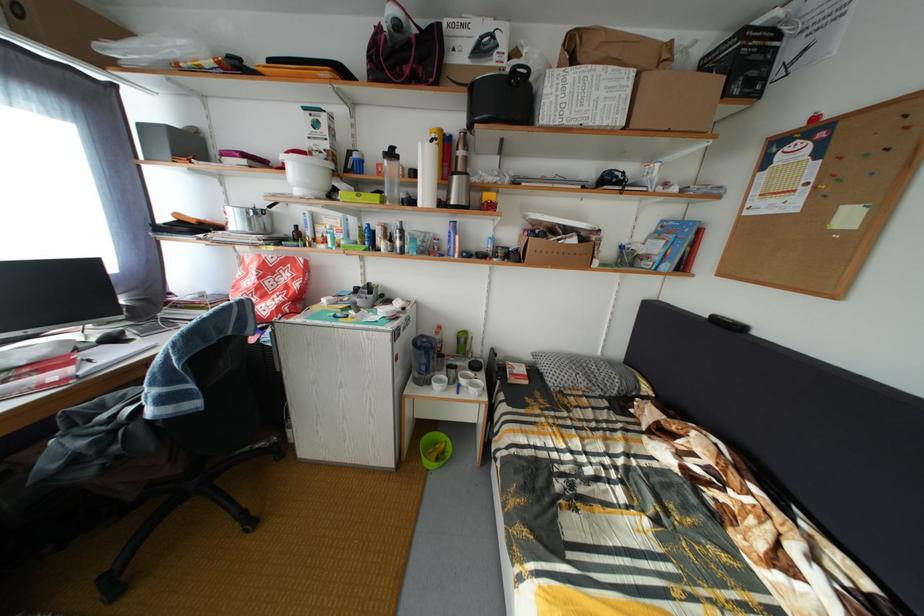
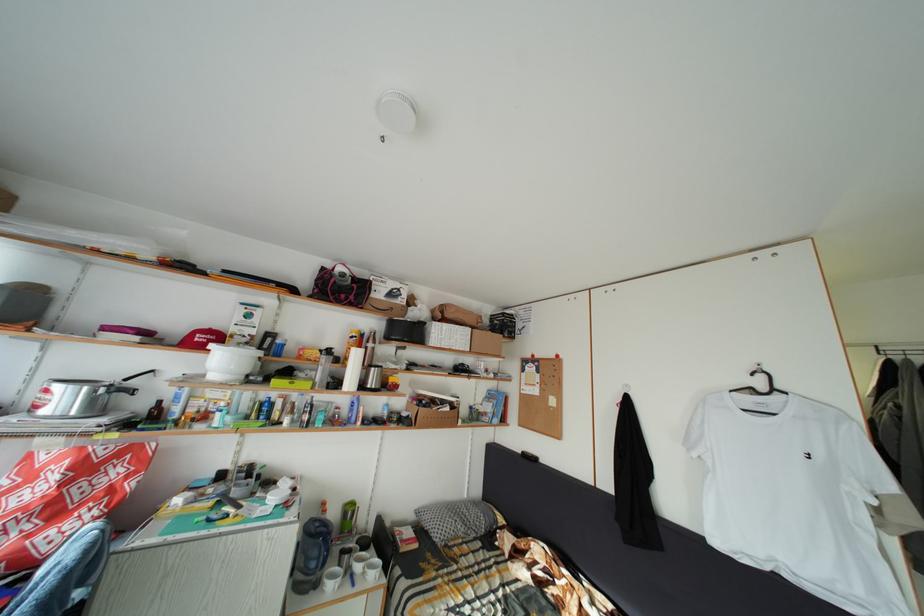
First-person continuous shooting, in which direction is the camera rotating?

The camera's rotation is toward right-up.